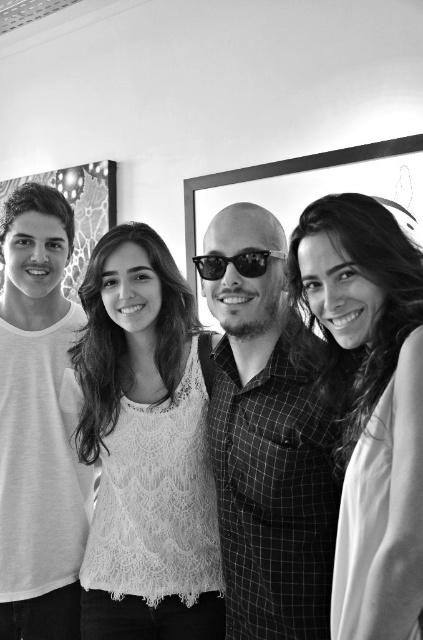
Is grid-patterned shirt at center to the left of white lace top at center from the viewer's perspective?

Yes, grid-patterned shirt at center is to the left of white lace top at center.

Between point (252, 460) and point (362, 349), which one is positioned in front?

Point (362, 349) is in front.

At what (x,y) coordinates should I click in order to perform the action: click on grid-patterned shirt at center. Please return your answer as a coordinate pair (x, y). The image size is (423, 640). Looking at the image, I should click on (272, 460).

Does lace fabric top at center have a lesser height compared to black reflective sunglasses at center?

In fact, lace fabric top at center may be taller than black reflective sunglasses at center.

Between lace fabric top at center and black reflective sunglasses at center, which one appears on the left side from the viewer's perspective?

From the viewer's perspective, lace fabric top at center appears more on the left side.

Where is `lace fabric top at center`? The width and height of the screenshot is (423, 640). lace fabric top at center is located at coordinates pyautogui.click(x=145, y=449).

Is point (271, 556) closer to camera compared to point (217, 278)?

Yes.

Based on the photo, who is more distant from viewer, (217, 508) or (263, 262)?

Point (217, 508)

Does point (302, 580) lie behind point (222, 259)?

No, it is in front of (222, 259).

Where is `grid-patterned shirt at center`? This screenshot has width=423, height=640. grid-patterned shirt at center is located at coordinates pyautogui.click(x=272, y=460).